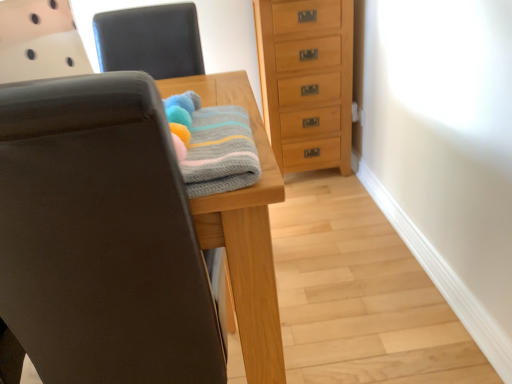
You are a GUI agent. You are given a task and a screenshot of the screen. Output one action in this format:
    pyautogui.click(x=<x>, y=<y>)
    Task: Click on the knitted cotton towel at center
    
    Given the screenshot: What is the action you would take?
    pyautogui.click(x=220, y=152)

What do you see at coordinates (306, 81) in the screenshot?
I see `light brown wood chest of drawers at center right` at bounding box center [306, 81].

This screenshot has width=512, height=384. I want to click on leather-like black chair at upper center, which appears as the 1th chair when viewed from the top, so click(150, 40).

Does matte black chair at left, arranged as the 2th chair when viewed from the top, touch leather-like black chair at upper center, which appears as the second chair when ordered from the bottom?

No, matte black chair at left, arranged as the 2th chair when viewed from the top, is not in contact with leather-like black chair at upper center, which appears as the second chair when ordered from the bottom.

Is matte black chair at left, placed as the first chair when sorted from bottom to top, oriented away from leather-like black chair at upper center, which appears as the 1th chair when viewed from the top?

That's not correct — matte black chair at left, placed as the first chair when sorted from bottom to top, is not looking away from leather-like black chair at upper center, which appears as the 1th chair when viewed from the top.

Between matte black chair at left, arranged as the 2th chair when viewed from the top, and leather-like black chair at upper center, which appears as the second chair when ordered from the bottom, which one has larger size?

Bigger between the two is matte black chair at left, arranged as the 2th chair when viewed from the top.

From the image's perspective, is matte black chair at left, placed as the first chair when sorted from bottom to top, under leather-like black chair at upper center, which appears as the 1th chair when viewed from the top?

Yes.

Consider the image. From a real-world perspective, does leather-like black chair at upper center, which appears as the second chair when ordered from the bottom, stand above knitted cotton towel at center?

Correct, in the physical world, leather-like black chair at upper center, which appears as the second chair when ordered from the bottom, is higher than knitted cotton towel at center.

Would you say leather-like black chair at upper center, which appears as the second chair when ordered from the bottom, contains knitted cotton towel at center?

No, leather-like black chair at upper center, which appears as the second chair when ordered from the bottom, does not contain knitted cotton towel at center.

The height and width of the screenshot is (384, 512). Find the location of `chair above the knitted cotton towel at center (from the image's perspective)`. chair above the knitted cotton towel at center (from the image's perspective) is located at coordinates (150, 40).

From the image's perspective, who appears lower, leather-like black chair at upper center, which appears as the second chair when ordered from the bottom, or knitted cotton towel at center?

knitted cotton towel at center is shown below in the image.

Considering the sizes of objects leather-like black chair at upper center, which appears as the 1th chair when viewed from the top, and light brown wood chest of drawers at center right in the image provided, who is taller, leather-like black chair at upper center, which appears as the 1th chair when viewed from the top, or light brown wood chest of drawers at center right?

light brown wood chest of drawers at center right is taller.

Between leather-like black chair at upper center, which appears as the 1th chair when viewed from the top, and light brown wood chest of drawers at center right, which one has smaller width?

Thinner between the two is leather-like black chair at upper center, which appears as the 1th chair when viewed from the top.

Considering the points (125, 45) and (287, 118), which point is behind, point (125, 45) or point (287, 118)?

The point (287, 118) is more distant.

Between leather-like black chair at upper center, which appears as the 1th chair when viewed from the top, and light brown wood chest of drawers at center right, which one appears on the left side from the viewer's perspective?

leather-like black chair at upper center, which appears as the 1th chair when viewed from the top.

Is matte black chair at left, placed as the first chair when sorted from bottom to top, located outside light brown wood chest of drawers at center right?

matte black chair at left, placed as the first chair when sorted from bottom to top, is positioned outside light brown wood chest of drawers at center right.

From the image's perspective, is matte black chair at left, arranged as the 2th chair when viewed from the top, positioned above or below light brown wood chest of drawers at center right?

Clearly, from the image's perspective, matte black chair at left, arranged as the 2th chair when viewed from the top, is below light brown wood chest of drawers at center right.

Which is in front, matte black chair at left, arranged as the 2th chair when viewed from the top, or light brown wood chest of drawers at center right?

matte black chair at left, arranged as the 2th chair when viewed from the top, is closer to the camera.

In the scene shown: Is matte black chair at left, placed as the first chair when sorted from bottom to top, taller than light brown wood chest of drawers at center right?

Yes, matte black chair at left, placed as the first chair when sorted from bottom to top, is taller than light brown wood chest of drawers at center right.

Where is `chest of drawers above the matte black chair at left, arranged as the 2th chair when viewed from the top (from the image's perspective)`? chest of drawers above the matte black chair at left, arranged as the 2th chair when viewed from the top (from the image's perspective) is located at coordinates click(306, 81).

Can matte black chair at left, placed as the first chair when sorted from bottom to top, be found inside light brown wood chest of drawers at center right?

That's incorrect, matte black chair at left, placed as the first chair when sorted from bottom to top, is not inside light brown wood chest of drawers at center right.

Consider the image. Considering the positions of objects light brown wood chest of drawers at center right and matte black chair at left, placed as the first chair when sorted from bottom to top, in the image provided, who is more to the left, light brown wood chest of drawers at center right or matte black chair at left, placed as the first chair when sorted from bottom to top,?

From the viewer's perspective, matte black chair at left, placed as the first chair when sorted from bottom to top, appears more on the left side.

Can you confirm if light brown wood chest of drawers at center right is thinner than matte black chair at left, placed as the first chair when sorted from bottom to top?

Indeed, light brown wood chest of drawers at center right has a lesser width compared to matte black chair at left, placed as the first chair when sorted from bottom to top.

From their relative heights in the image, would you say leather-like black chair at upper center, which appears as the second chair when ordered from the bottom, is taller or shorter than matte black chair at left, placed as the first chair when sorted from bottom to top?

Clearly, leather-like black chair at upper center, which appears as the second chair when ordered from the bottom, is shorter compared to matte black chair at left, placed as the first chair when sorted from bottom to top.

From the image's perspective, between leather-like black chair at upper center, which appears as the second chair when ordered from the bottom, and matte black chair at left, placed as the first chair when sorted from bottom to top, which one is located above?

leather-like black chair at upper center, which appears as the second chair when ordered from the bottom, from the image's perspective.

Does leather-like black chair at upper center, which appears as the 1th chair when viewed from the top, turn towards matte black chair at left, placed as the first chair when sorted from bottom to top?

Yes.

Is light brown wood chest of drawers at center right facing away from knitted cotton towel at center?

That's not correct — light brown wood chest of drawers at center right is not looking away from knitted cotton towel at center.

Is light brown wood chest of drawers at center right situated inside knitted cotton towel at center or outside?

light brown wood chest of drawers at center right is not enclosed by knitted cotton towel at center.

Locate an element on the screen. This screenshot has width=512, height=384. bath towel on the left of the light brown wood chest of drawers at center right is located at coordinates (220, 152).

Are light brown wood chest of drawers at center right and knitted cotton towel at center beside each other?

light brown wood chest of drawers at center right is not next to knitted cotton towel at center, and they're not touching.

The width and height of the screenshot is (512, 384). I want to click on chair above the matte black chair at left, arranged as the 2th chair when viewed from the top (from the image's perspective), so click(150, 40).

Where is `bath towel that appears below the leather-like black chair at upper center, which appears as the 1th chair when viewed from the top (from a real-world perspective)`? The image size is (512, 384). bath towel that appears below the leather-like black chair at upper center, which appears as the 1th chair when viewed from the top (from a real-world perspective) is located at coordinates (220, 152).

Based on their spatial positions, is knitted cotton towel at center or leather-like black chair at upper center, which appears as the second chair when ordered from the bottom, closer to matte black chair at left, arranged as the 2th chair when viewed from the top?

Based on the image, knitted cotton towel at center appears to be nearer to matte black chair at left, arranged as the 2th chair when viewed from the top.

From the image, which object appears to be farther from knitted cotton towel at center, light brown wood chest of drawers at center right or leather-like black chair at upper center, which appears as the second chair when ordered from the bottom?

light brown wood chest of drawers at center right is positioned further to the anchor knitted cotton towel at center.

Based on their spatial positions, is matte black chair at left, placed as the first chair when sorted from bottom to top, or leather-like black chair at upper center, which appears as the 1th chair when viewed from the top, further from knitted cotton towel at center?

Among the two, leather-like black chair at upper center, which appears as the 1th chair when viewed from the top, is located further to knitted cotton towel at center.

When comparing their distances from matte black chair at left, arranged as the 2th chair when viewed from the top, does light brown wood chest of drawers at center right or leather-like black chair at upper center, which appears as the second chair when ordered from the bottom, seem further?

Based on the image, light brown wood chest of drawers at center right appears to be further to matte black chair at left, arranged as the 2th chair when viewed from the top.

Which object lies further to the anchor point knitted cotton towel at center, matte black chair at left, placed as the first chair when sorted from bottom to top, or light brown wood chest of drawers at center right?

The object further to knitted cotton towel at center is light brown wood chest of drawers at center right.

Which object lies nearer to the anchor point knitted cotton towel at center, leather-like black chair at upper center, which appears as the second chair when ordered from the bottom, or light brown wood chest of drawers at center right?

Based on the image, leather-like black chair at upper center, which appears as the second chair when ordered from the bottom, appears to be nearer to knitted cotton towel at center.

Looking at the image, which one is located further to light brown wood chest of drawers at center right, leather-like black chair at upper center, which appears as the second chair when ordered from the bottom, or knitted cotton towel at center?

Among the two, knitted cotton towel at center is located further to light brown wood chest of drawers at center right.

Estimate the real-world distances between objects in this image. Which object is closer to matte black chair at left, placed as the first chair when sorted from bottom to top, leather-like black chair at upper center, which appears as the 1th chair when viewed from the top, or light brown wood chest of drawers at center right?

leather-like black chair at upper center, which appears as the 1th chair when viewed from the top.

Locate an element on the screen. The height and width of the screenshot is (384, 512). bath towel between matte black chair at left, placed as the first chair when sorted from bottom to top, and leather-like black chair at upper center, which appears as the second chair when ordered from the bottom, in the front-back direction is located at coordinates (220, 152).

The height and width of the screenshot is (384, 512). What are the coordinates of `chair between matte black chair at left, placed as the first chair when sorted from bottom to top, and light brown wood chest of drawers at center right in the front-back direction` in the screenshot? It's located at (150, 40).

The image size is (512, 384). I want to click on bath towel between matte black chair at left, arranged as the 2th chair when viewed from the top, and light brown wood chest of drawers at center right in the front-back direction, so click(220, 152).

This screenshot has width=512, height=384. I want to click on chair between knitted cotton towel at center and light brown wood chest of drawers at center right along the z-axis, so click(150, 40).